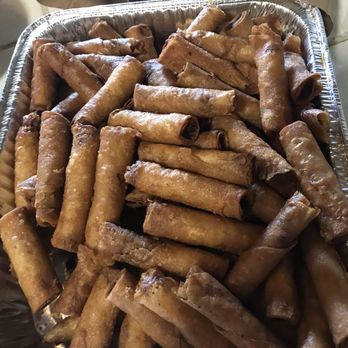
At what (x,y) coordinates should I click in order to perform the action: click on counter. Please return your answer as a coordinate pair (x, y). Looking at the image, I should click on (341, 55).